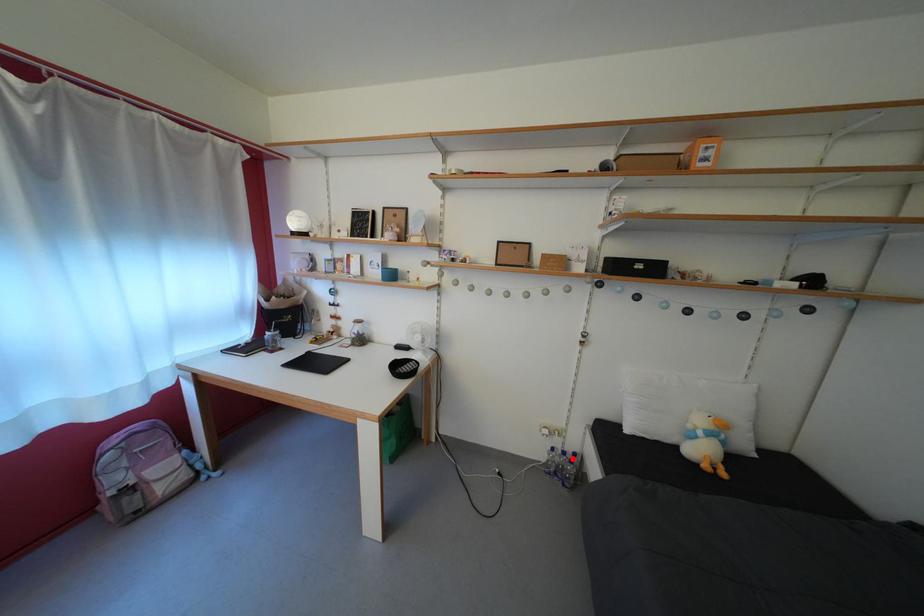
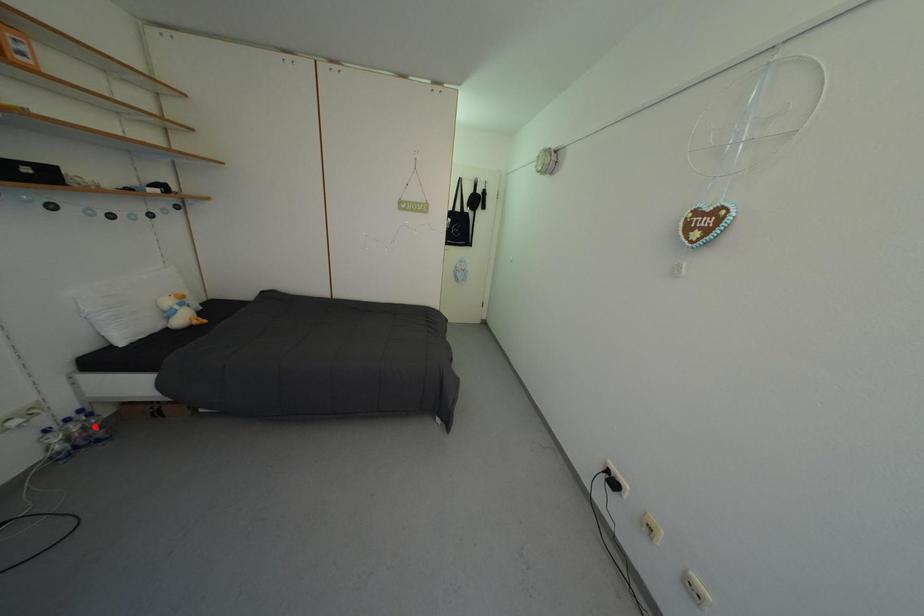
I am providing you with two images of the same scene from different viewpoints. A red point is marked on the first image and another point is marked on the second image. Are the points marked in image1 and image2 representing the same 3D position?

No